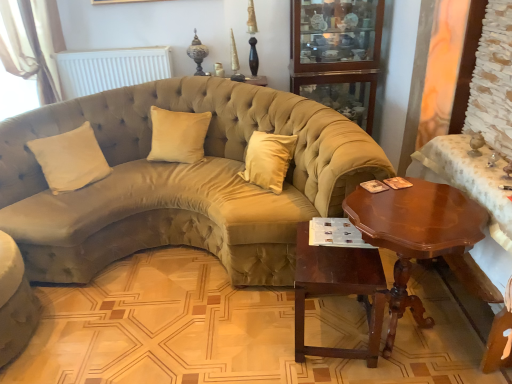
Question: Is there a large distance between beige fabric curtain at upper left and glass cabinet at upper center?

Choices:
 (A) no
 (B) yes

Answer: (B)

Question: Considering the relative sizes of beige fabric curtain at upper left and glass cabinet at upper center in the image provided, is beige fabric curtain at upper left wider than glass cabinet at upper center?

Choices:
 (A) yes
 (B) no

Answer: (B)

Question: Is beige fabric curtain at upper left to the left of glass cabinet at upper center from the viewer's perspective?

Choices:
 (A) yes
 (B) no

Answer: (A)

Question: Does beige fabric curtain at upper left lie behind glass cabinet at upper center?

Choices:
 (A) no
 (B) yes

Answer: (A)

Question: Is glass cabinet at upper center completely or partially inside beige fabric curtain at upper left?

Choices:
 (A) yes
 (B) no

Answer: (B)

Question: In terms of width, does beige velvet pillow at left, which is the second pillow from right to left, look wider or thinner when compared to shiny brown wood coffee table at right?

Choices:
 (A) thin
 (B) wide

Answer: (A)

Question: Is beige velvet pillow at left, which is the second pillow from right to left, situated inside shiny brown wood coffee table at right or outside?

Choices:
 (A) outside
 (B) inside

Answer: (A)

Question: Based on their sizes in the image, would you say beige velvet pillow at left, the 1th pillow in the left-to-right sequence, is bigger or smaller than shiny brown wood coffee table at right?

Choices:
 (A) small
 (B) big

Answer: (A)

Question: Is point (53, 162) closer or farther from the camera than point (382, 203)?

Choices:
 (A) farther
 (B) closer

Answer: (A)

Question: Considering the positions of point click(x=20, y=56) and point click(x=434, y=248), is point click(x=20, y=56) closer or farther from the camera than point click(x=434, y=248)?

Choices:
 (A) closer
 (B) farther

Answer: (B)

Question: Considering the positions of beige fabric curtain at upper left and shiny brown wood coffee table at right in the image, is beige fabric curtain at upper left wider or thinner than shiny brown wood coffee table at right?

Choices:
 (A) wide
 (B) thin

Answer: (B)

Question: In terms of height, does beige fabric curtain at upper left look taller or shorter compared to shiny brown wood coffee table at right?

Choices:
 (A) tall
 (B) short

Answer: (A)

Question: From a real-world perspective, is beige fabric curtain at upper left physically located above or below shiny brown wood coffee table at right?

Choices:
 (A) below
 (B) above

Answer: (B)

Question: From a real-world perspective, is shiny brown wood coffee table at right positioned above or below suede beige couch at center, which is the first studio couch in right-to-left order?

Choices:
 (A) above
 (B) below

Answer: (B)

Question: Would you say shiny brown wood coffee table at right is inside or outside suede beige couch at center, which ranks as the 2th studio couch in left-to-right order?

Choices:
 (A) outside
 (B) inside

Answer: (A)